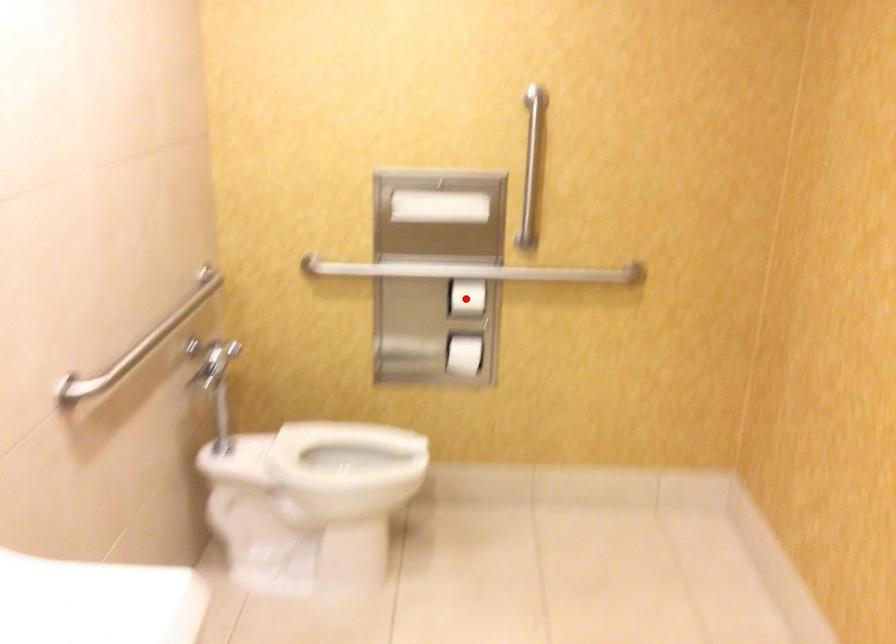
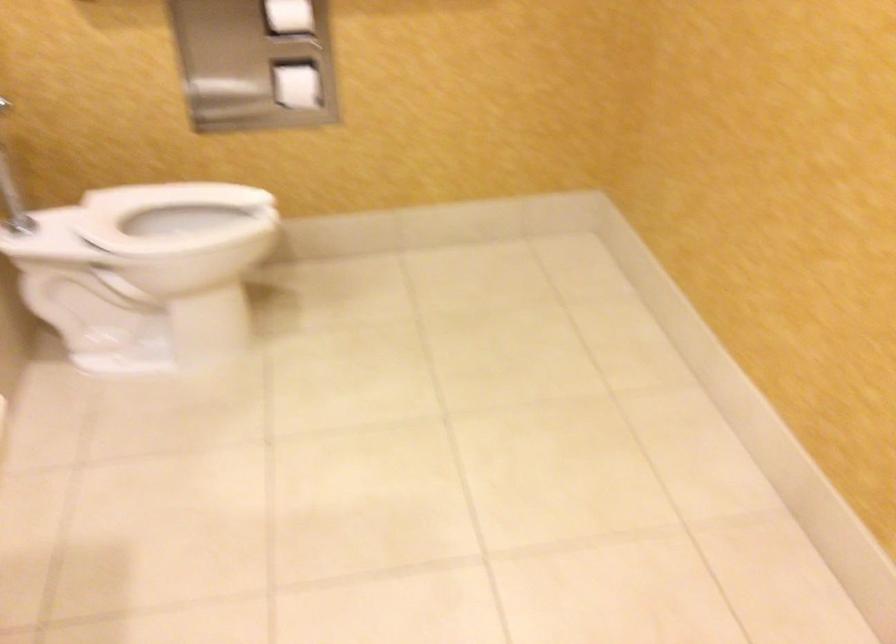
Question: I am providing you with two images of the same scene from different viewpoints. In image1, a red point is highlighted. Considering the same 3D point in image2, which of the following is correct?

Choices:
 (A) It is closer
 (B) It is farther

Answer: (A)